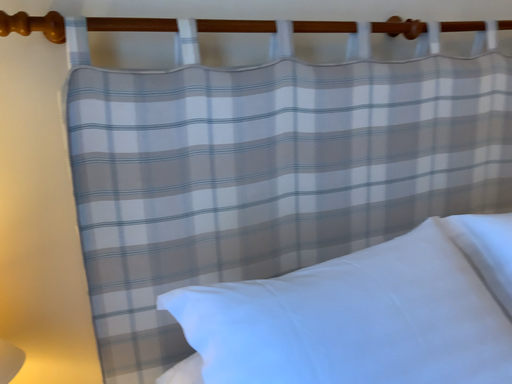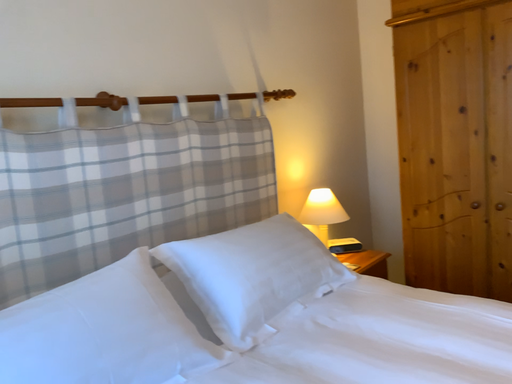
Question: Which way did the camera rotate in the video?

Choices:
 (A) rotated left
 (B) rotated right

Answer: (B)